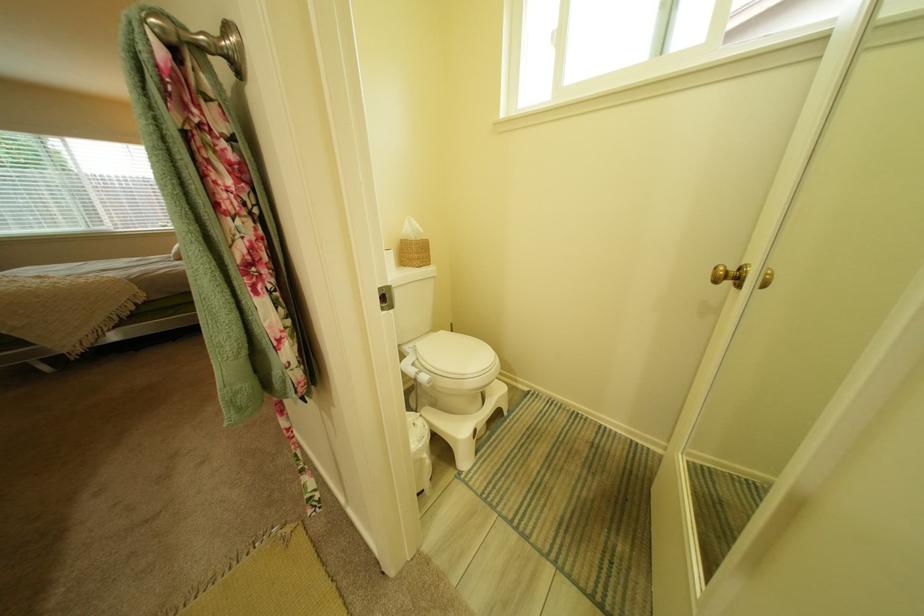
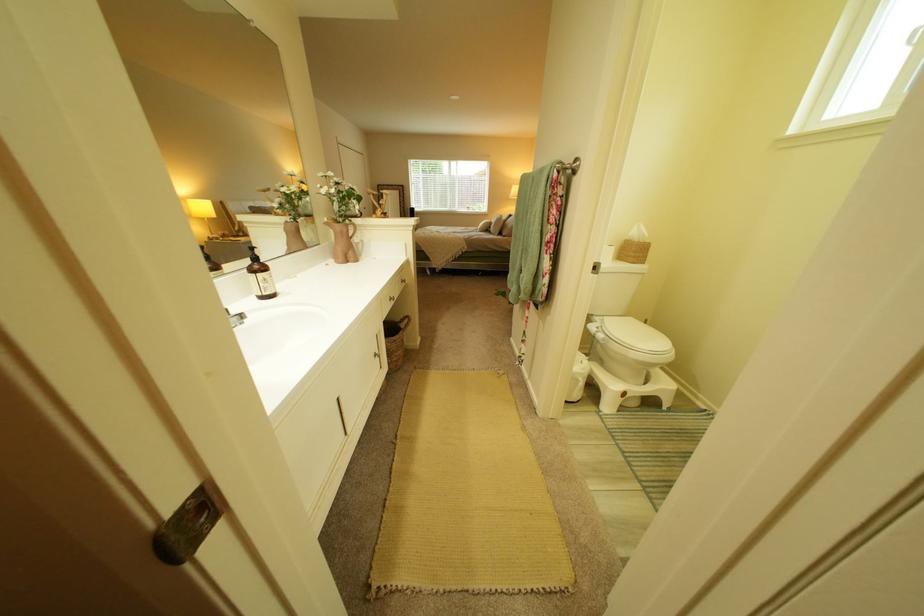
Locate, in the second image, the point that corresponds to (x=525, y=413) in the first image.

(685, 410)